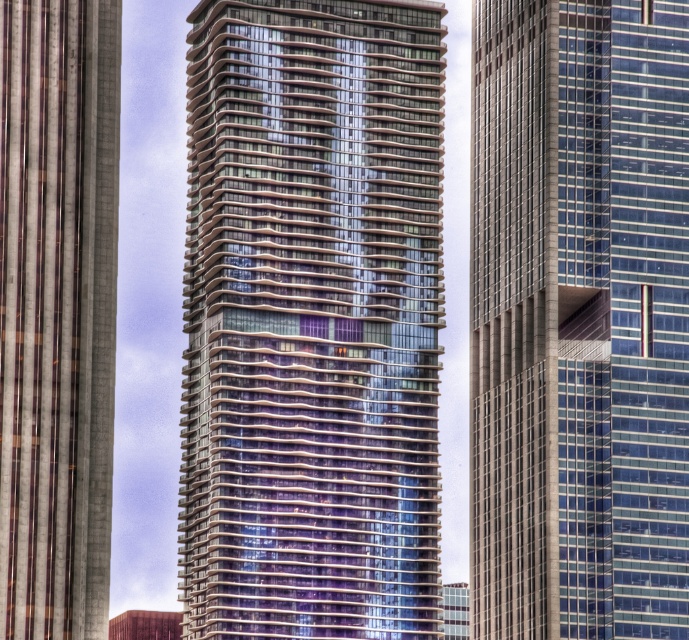
You are an architect evaluating the design of the glassy reflective skyscraper at center and the glassy reflective skyscraper at left. Which one has a larger footprint in the image?

The glassy reflective skyscraper at center is bigger than the glassy reflective skyscraper at left, so it has a larger footprint in the image.

You are an architect evaluating the central area of the city. You see the glassy reflective skyscraper at center and the glassy steel skyscraper at center. Which one has a greater width?

The glassy reflective skyscraper at center might be wider than glassy steel skyscraper at center, so it has a greater width.

You are an architect analyzing the layout of the city. You see the glassy reflective skyscraper at center and the glassy steel skyscraper at center. Which one is closer to you?

The glassy reflective skyscraper at center is closer to you because it is in front of the glassy steel skyscraper at center.